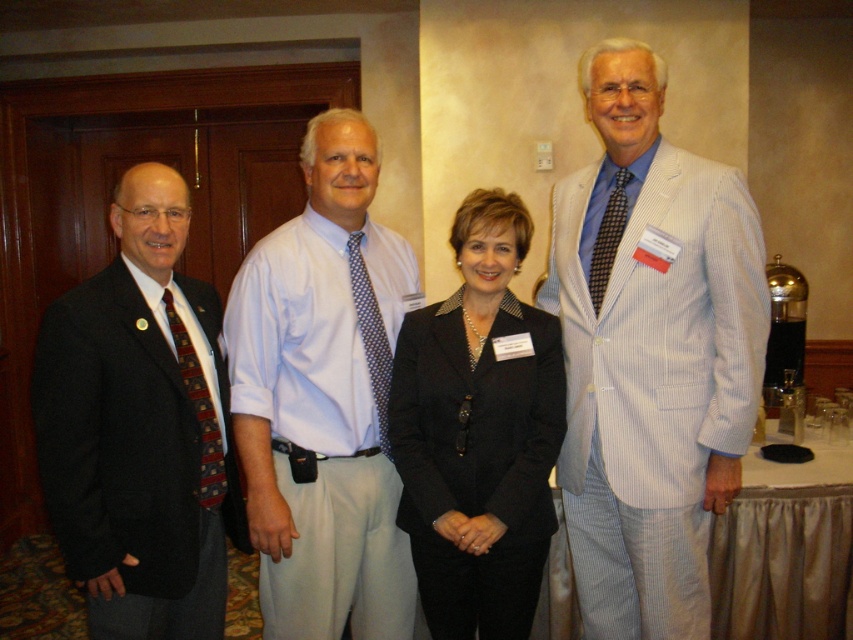
You are a photographer positioned at the back of the room. You need to take a photo of the dark gray suit at left and the red plaid tie at left. Which one will appear larger in the photo?

The dark gray suit at left will appear larger in the photo because it is closer to the viewer than the red plaid tie at left.

In the scene shown: You are a photographer at the event and need to ensure everyone is visible in the group photo. Considering the dark gray suit at left and the red plaid tie at left, which one might block the view of the other if they stand side by side?

The dark gray suit at left is much taller than the red plaid tie at left, so the dark gray suit at left could block the view of the red plaid tie at left if they stand side by side.